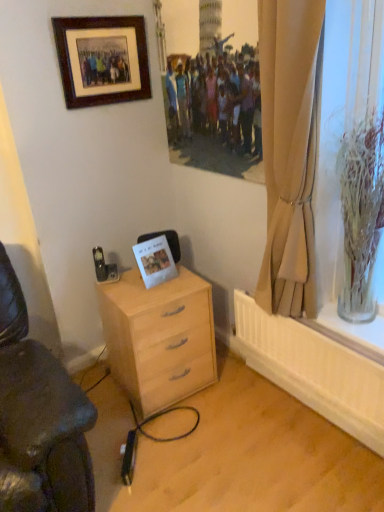
Question: In terms of height, does white paper postcard at center look taller or shorter compared to clear glass vase at right?

Choices:
 (A) tall
 (B) short

Answer: (B)

Question: Looking at the image, does white paper postcard at center seem bigger or smaller compared to clear glass vase at right?

Choices:
 (A) big
 (B) small

Answer: (B)

Question: Considering the real-world distances, which object is closest to the light wood/finish desk at lower center?

Choices:
 (A) wooden picture frame at upper left
 (B) clear glass vase at right
 (C) white paper postcard at center
 (D) beige fabric curtain at right

Answer: (C)

Question: Which is farther from the white paper postcard at center?

Choices:
 (A) wooden picture frame at upper left
 (B) clear glass vase at right
 (C) beige fabric curtain at right
 (D) light wood/finish desk at lower center

Answer: (B)